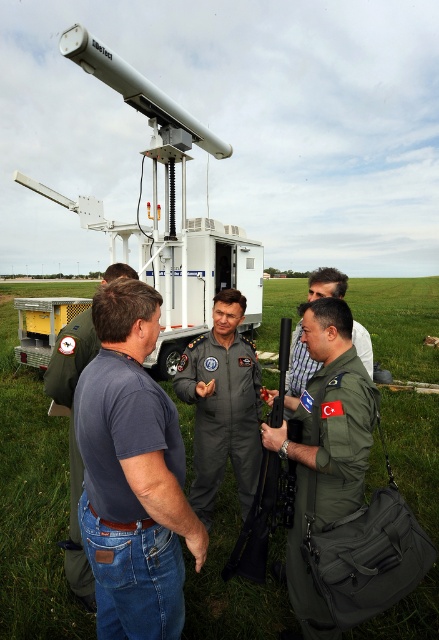
Question: Is dark blue t-shirt at center wider than yellow mesh trailer truck at lower left?

Choices:
 (A) yes
 (B) no

Answer: (A)

Question: Considering the relative positions of white plastic trailer truck at upper center and blue denim jeans at lower left in the image provided, where is white plastic trailer truck at upper center located with respect to blue denim jeans at lower left?

Choices:
 (A) below
 (B) above

Answer: (B)

Question: Which is farther from the white plastic trailer truck at upper center?

Choices:
 (A) yellow mesh trailer truck at lower left
 (B) dark blue t-shirt at center

Answer: (B)

Question: Which of the following is the closest to the observer?

Choices:
 (A) green uniform at center
 (B) green fabric uniform at center
 (C) dark gray uniform at center

Answer: (B)

Question: Which point is closer to the camera?

Choices:
 (A) yellow mesh trailer truck at lower left
 (B) matte black rifle at center
 (C) blue denim jeans at lower left
 (D) green uniform at center

Answer: (B)

Question: Does blue denim jeans at lower left have a greater width compared to green uniform at center?

Choices:
 (A) yes
 (B) no

Answer: (A)